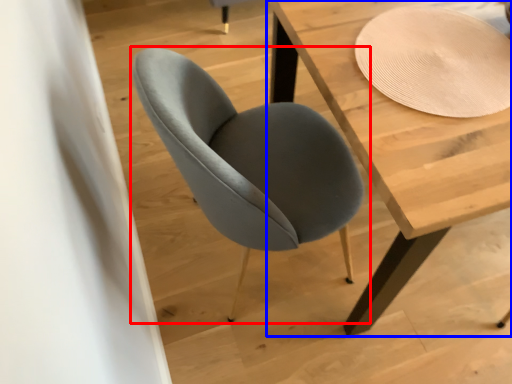
Question: Which of the following is the closest to the observer, chair (highlighted by a red box) or table (highlighted by a blue box)?

Choices:
 (A) chair
 (B) table

Answer: (A)